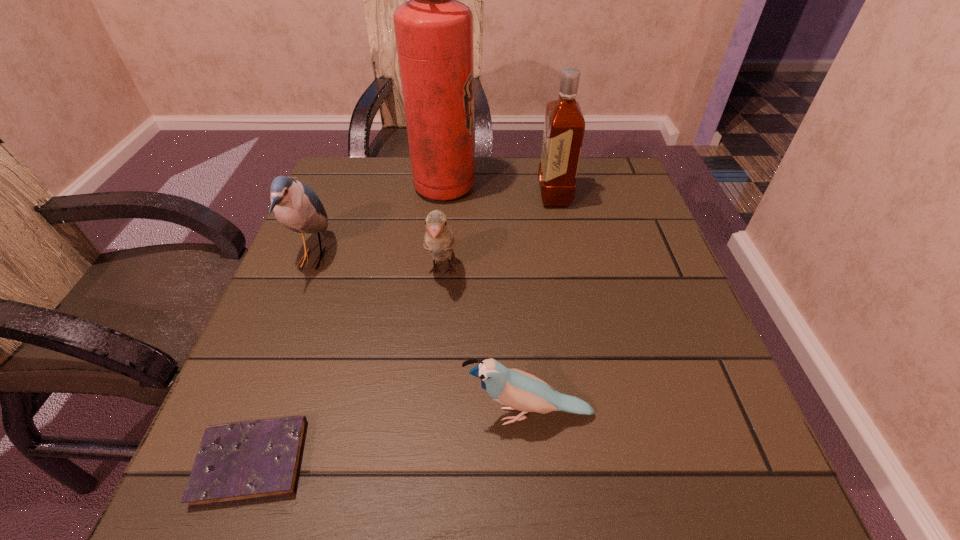
This screenshot has width=960, height=540. In order to click on free space that is in between the tallest object and the nearest bird in this screenshot , I will do `click(487, 301)`.

Find the location of a particular element. This screenshot has width=960, height=540. unoccupied area between the rightmost bird and the second bird from right to left is located at coordinates (486, 343).

You are a GUI agent. You are given a task and a screenshot of the screen. Output one action in this format:
    pyautogui.click(x=<x>, y=<y>)
    Task: Click on the free point between the second bird from left to right and the fifth shortest object
    The height and width of the screenshot is (540, 960).
    Given the screenshot: What is the action you would take?
    pyautogui.click(x=498, y=234)

What are the coordinates of `vacant region between the leftmost bird and the rightmost bird` in the screenshot? It's located at (420, 336).

Locate an element on the screen. free area in between the diary and the second tallest object is located at coordinates (403, 328).

Identify the location of free space between the shortest object and the nearest bird. This screenshot has height=540, width=960. (391, 438).

Where is `vacant point located between the fire extinguisher and the leftmost bird`? This screenshot has width=960, height=540. vacant point located between the fire extinguisher and the leftmost bird is located at coordinates (378, 222).

Image resolution: width=960 pixels, height=540 pixels. Identify the location of empty space between the leftmost bird and the rightmost bird. (420, 336).

Identify the location of free space that is in between the second tallest object and the tallest object. The height and width of the screenshot is (540, 960). (499, 192).

The height and width of the screenshot is (540, 960). I want to click on free space between the tallest bird and the second bird from left to right, so click(x=377, y=265).